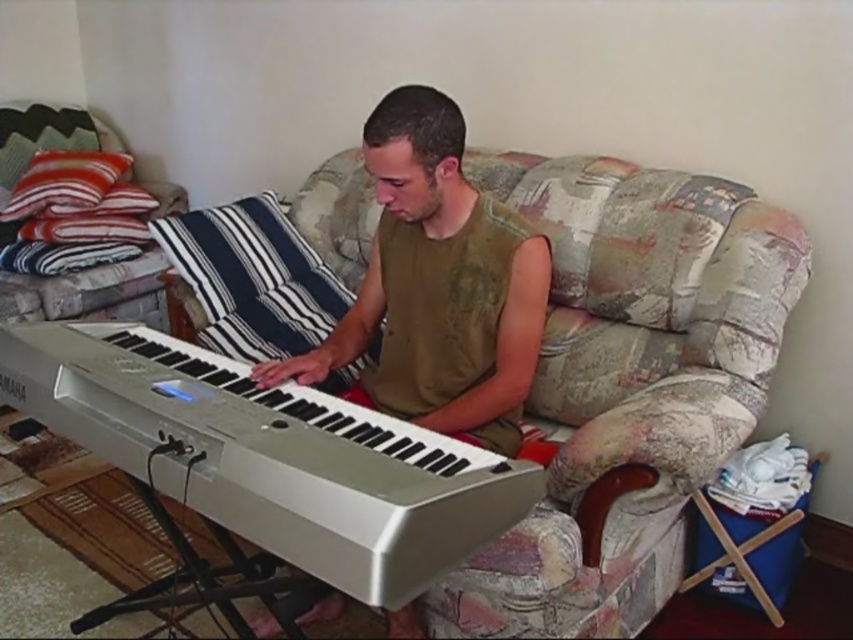
You are standing in the room and want to place a new decorative item on the white plastic keyboard at center. What are the coordinates where you should place it?

The coordinates for placing the decorative item on the white plastic keyboard at center are point (x=270, y=456).